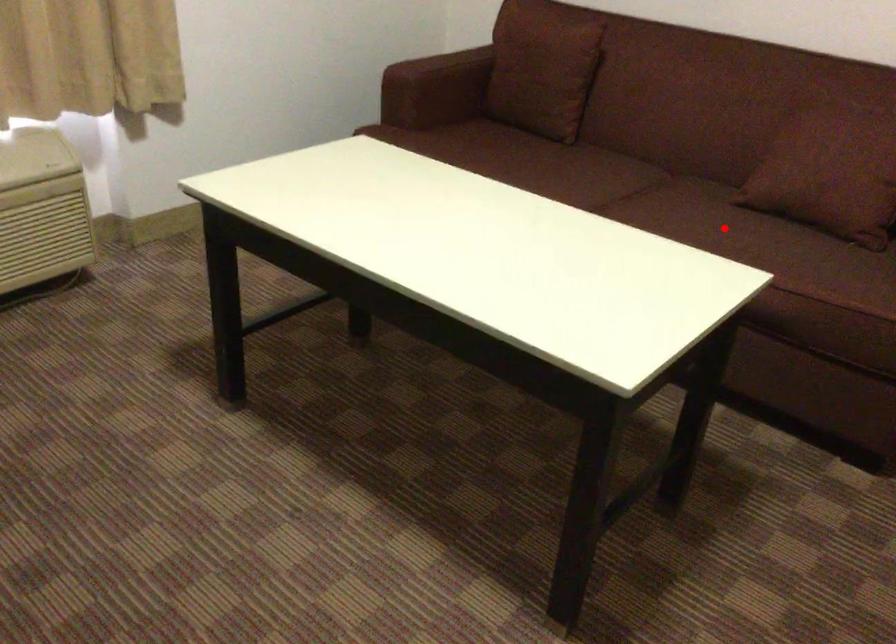
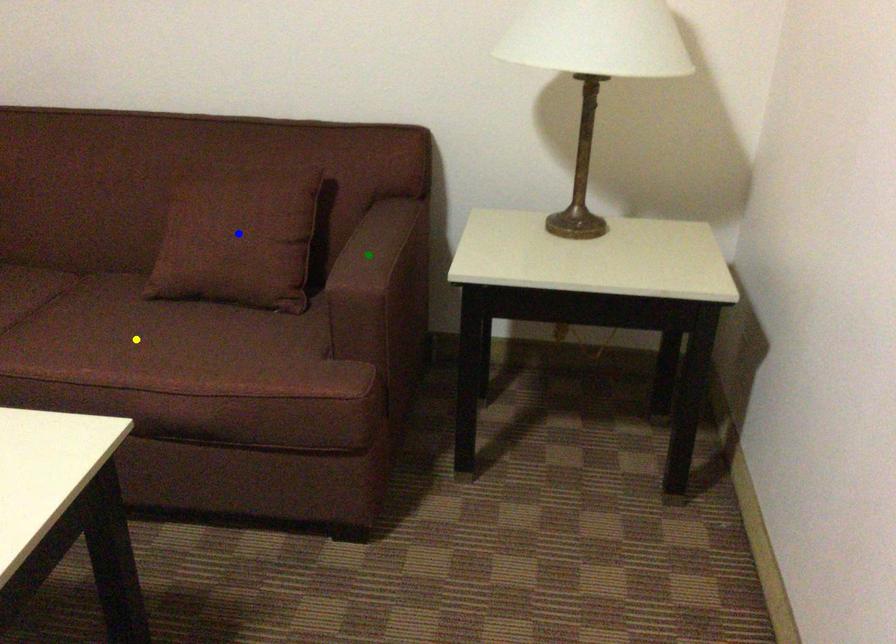
Question: I am providing you with two images of the same scene from different viewpoints. A red point is marked on the first image. You are given multiple points on the second image. In image 2, which mark is for the same physical point as the one in image 1?

Choices:
 (A) green point
 (B) yellow point
 (C) blue point

Answer: (B)